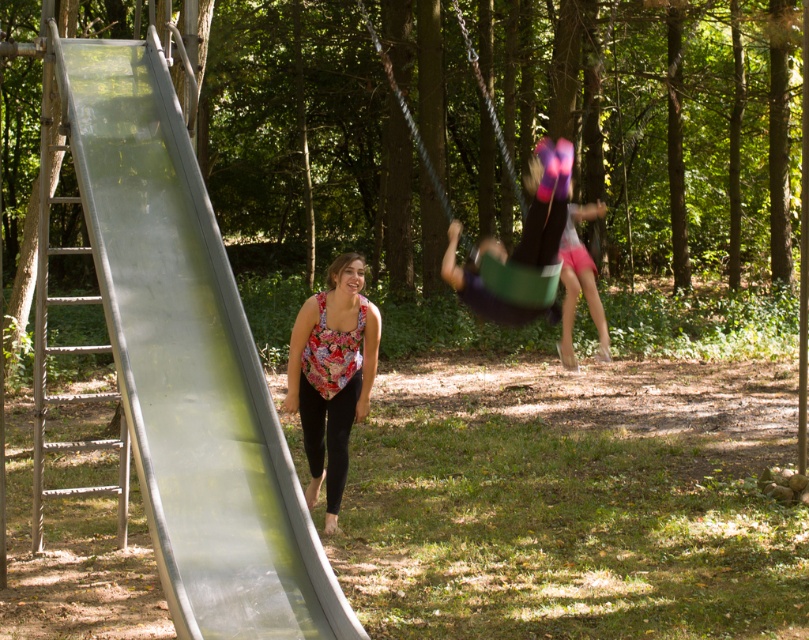
Question: Considering the relative positions of floral fabric top at center and green plastic swing at center in the image provided, where is floral fabric top at center located with respect to green plastic swing at center?

Choices:
 (A) left
 (B) right

Answer: (A)

Question: Can you confirm if metallic smooth slide at left is positioned to the left of floral fabric top at center?

Choices:
 (A) yes
 (B) no

Answer: (A)

Question: Observing the image, what is the correct spatial positioning of floral fabric top at center in reference to green plastic swing at center?

Choices:
 (A) above
 (B) below

Answer: (B)

Question: Estimate the real-world distances between objects in this image. Which object is closer to the floral fabric top at center?

Choices:
 (A) metallic smooth slide at left
 (B) green plastic swing at center

Answer: (A)

Question: Considering the real-world distances, which object is farthest from the metallic smooth slide at left?

Choices:
 (A) green plastic swing at center
 (B) floral fabric top at center

Answer: (A)

Question: Which point is closer to the camera?

Choices:
 (A) metallic smooth slide at left
 (B) green plastic swing at center

Answer: (A)